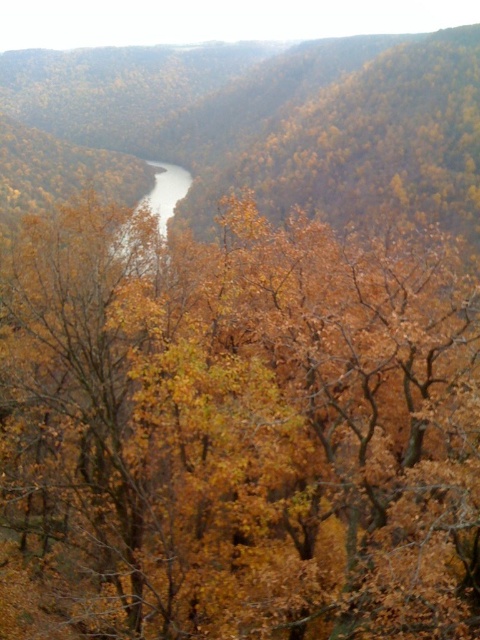
Can you confirm if yellow leafy tree at center is bigger than gray smooth water at center?

No, yellow leafy tree at center is not bigger than gray smooth water at center.

Image resolution: width=480 pixels, height=640 pixels. Describe the element at coordinates (240, 429) in the screenshot. I see `yellow leafy tree at center` at that location.

Which is in front, point (326, 397) or point (157, 220)?

Point (326, 397) is more forward.

At what (x,y) coordinates should I click in order to perform the action: click on yellow leafy tree at center. Please return your answer as a coordinate pair (x, y). This screenshot has width=480, height=640. Looking at the image, I should click on (240, 429).